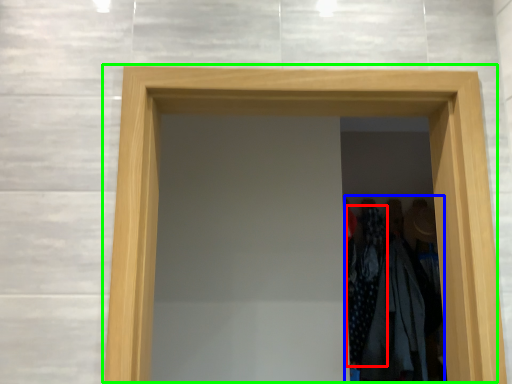
Question: Considering the real-world distances, which object is farthest from clothing (highlighted by a red box)? laundry (highlighted by a blue box) or door (highlighted by a green box)?

Choices:
 (A) laundry
 (B) door

Answer: (B)